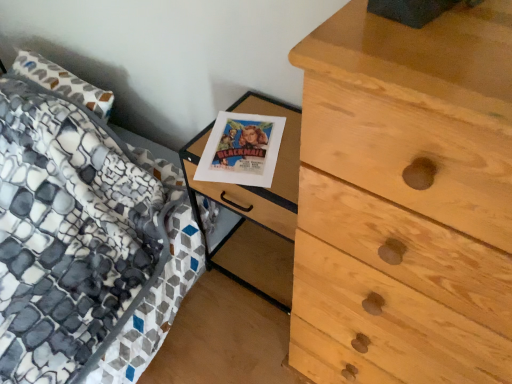
Find the location of a particular element. free point above wooden nightstand at center (from a real-world perspective) is located at coordinates (252, 142).